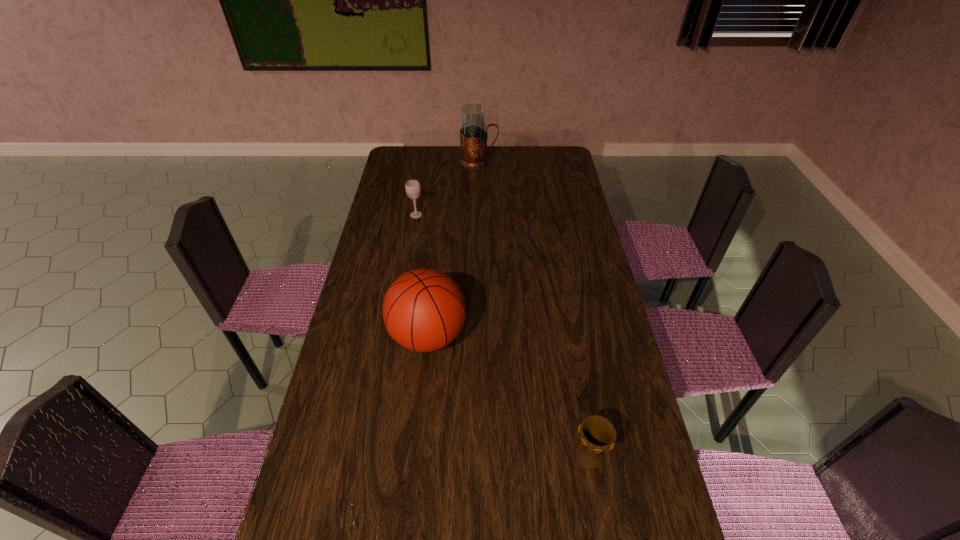
Image resolution: width=960 pixels, height=540 pixels. In order to click on basketball that is at the left edge in this screenshot , I will do `click(424, 310)`.

The image size is (960, 540). I want to click on wineglass that is at the left edge, so click(412, 187).

At what (x,y) coordinates should I click in order to perform the action: click on object located in the right edge section of the desktop. Please return your answer as a coordinate pair (x, y). The width and height of the screenshot is (960, 540). Looking at the image, I should click on (598, 434).

In the image, there is a desktop. Where is `vacant space at the left edge`? The image size is (960, 540). vacant space at the left edge is located at coordinates (291, 523).

The height and width of the screenshot is (540, 960). Find the location of `vacant region at the right edge of the desktop`. vacant region at the right edge of the desktop is located at coordinates (564, 206).

What are the coordinates of `vacant space at the far right corner of the desktop` in the screenshot? It's located at (552, 168).

Image resolution: width=960 pixels, height=540 pixels. I want to click on vacant space in between the chalice and the wineglass, so click(503, 335).

The height and width of the screenshot is (540, 960). I want to click on free space that is in between the nearest object and the basketball, so (509, 396).

I want to click on free spot between the pitcher and the rightmost object, so click(x=534, y=309).

This screenshot has width=960, height=540. Identify the location of free space between the farthest object and the third farthest object. (453, 248).